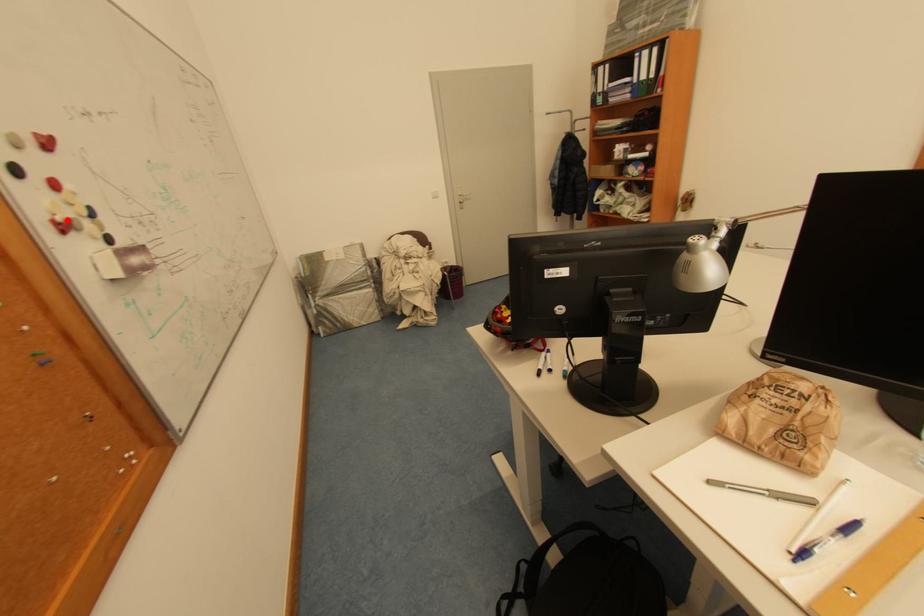
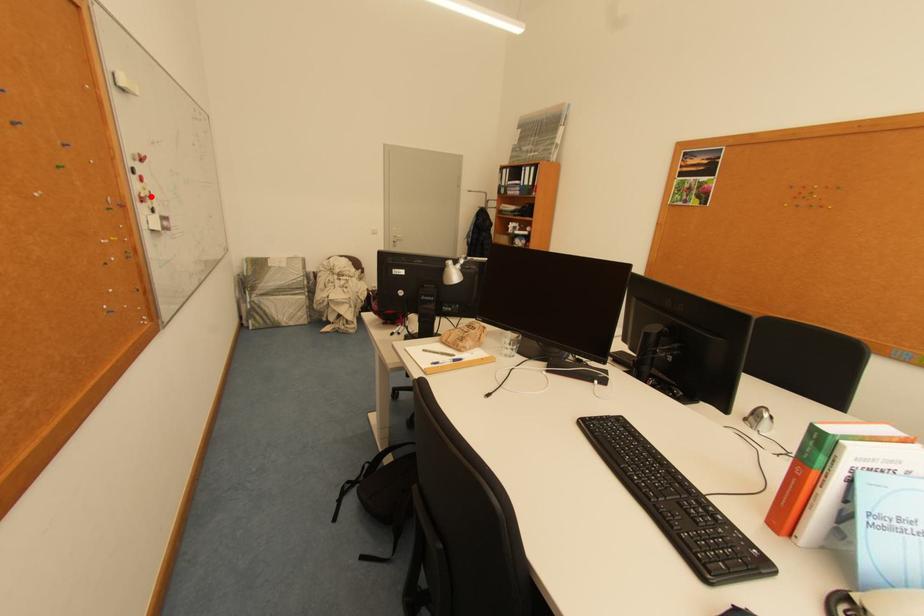
I am providing you with two images of the same scene from different viewpoints. A red point is marked on the first image and another point is marked on the second image. Do the highlighted points in image1 and image2 indicate the same real-world spot?

Yes